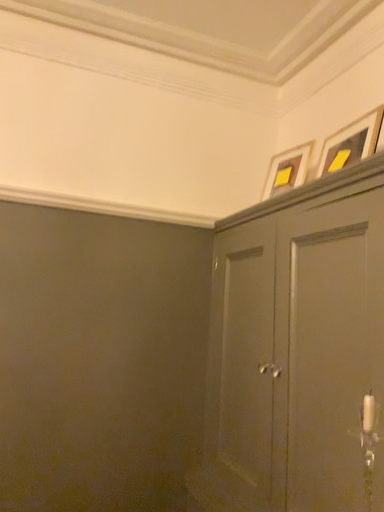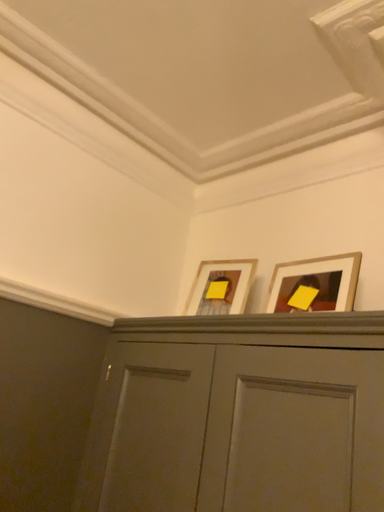
Question: Which way did the camera rotate in the video?

Choices:
 (A) rotated right
 (B) rotated left

Answer: (A)